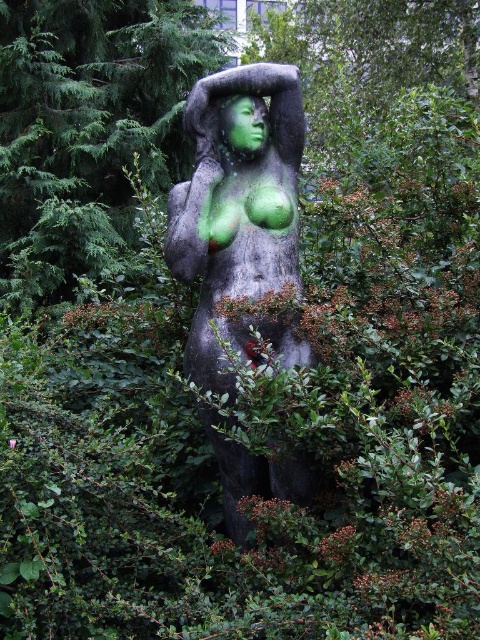
Question: Which point is farther from the camera taking this photo?

Choices:
 (A) (245, 134)
 (B) (278, 122)
 (C) (40, 141)

Answer: (C)

Question: Does green stone statue at center appear on the right side of green matte face at center?

Choices:
 (A) yes
 (B) no

Answer: (B)

Question: Among these objects, which one is farthest from the camera?

Choices:
 (A) green matte face at center
 (B) green matte statue at center
 (C) green stone statue at center

Answer: (B)

Question: Can you confirm if green stone statue at center is bigger than green matte face at center?

Choices:
 (A) yes
 (B) no

Answer: (A)

Question: Can you confirm if green stone statue at center is bigger than green matte face at center?

Choices:
 (A) yes
 (B) no

Answer: (A)

Question: Considering the real-world distances, which object is farthest from the green matte face at center?

Choices:
 (A) green stone statue at center
 (B) green matte statue at center

Answer: (B)